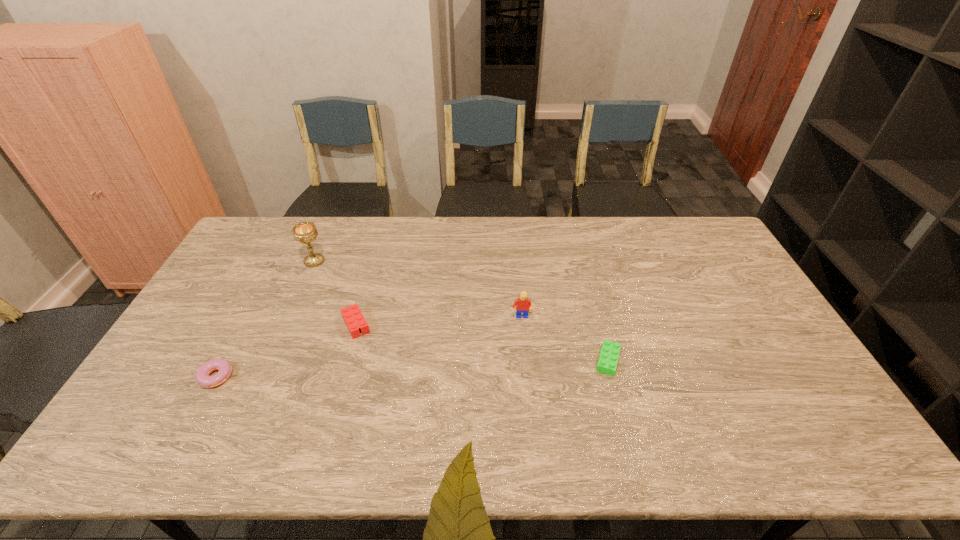
Where is `free spot between the second Lego from left to right and the doughnut`? The image size is (960, 540). free spot between the second Lego from left to right and the doughnut is located at coordinates (369, 346).

Find the location of a particular element. Image resolution: width=960 pixels, height=540 pixels. unoccupied position between the doughnut and the rightmost object is located at coordinates (413, 367).

The width and height of the screenshot is (960, 540). What are the coordinates of `empty space that is in between the rightmost Lego and the second object from left to right` in the screenshot? It's located at (461, 310).

Locate an element on the screen. The width and height of the screenshot is (960, 540). free space between the fourth object from left to right and the leftmost Lego is located at coordinates (438, 321).

Locate an element on the screen. The image size is (960, 540). vacant area that lies between the leftmost object and the rightmost object is located at coordinates (413, 367).

Locate an element on the screen. Image resolution: width=960 pixels, height=540 pixels. vacant space in between the doughnut and the fourth object from left to right is located at coordinates (369, 346).

The width and height of the screenshot is (960, 540). Find the location of `free space between the third object from right to left and the rightmost Lego`. free space between the third object from right to left and the rightmost Lego is located at coordinates (482, 342).

Image resolution: width=960 pixels, height=540 pixels. I want to click on vacant region between the third object from left to right and the farthest object, so click(x=335, y=293).

You are a GUI agent. You are given a task and a screenshot of the screen. Output one action in this format:
    pyautogui.click(x=<x>, y=<y>)
    Task: Click on the blank region between the doughnut and the farthest object
    The width and height of the screenshot is (960, 540).
    Given the screenshot: What is the action you would take?
    pyautogui.click(x=266, y=318)

Locate an element on the screen. The height and width of the screenshot is (540, 960). free spot between the fourth object from right to left and the tallest Lego is located at coordinates (418, 289).